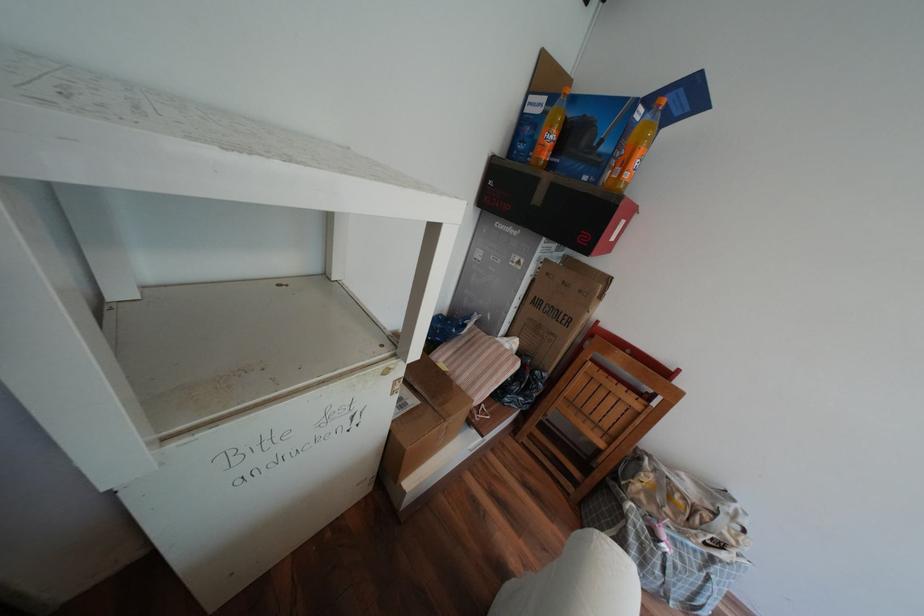
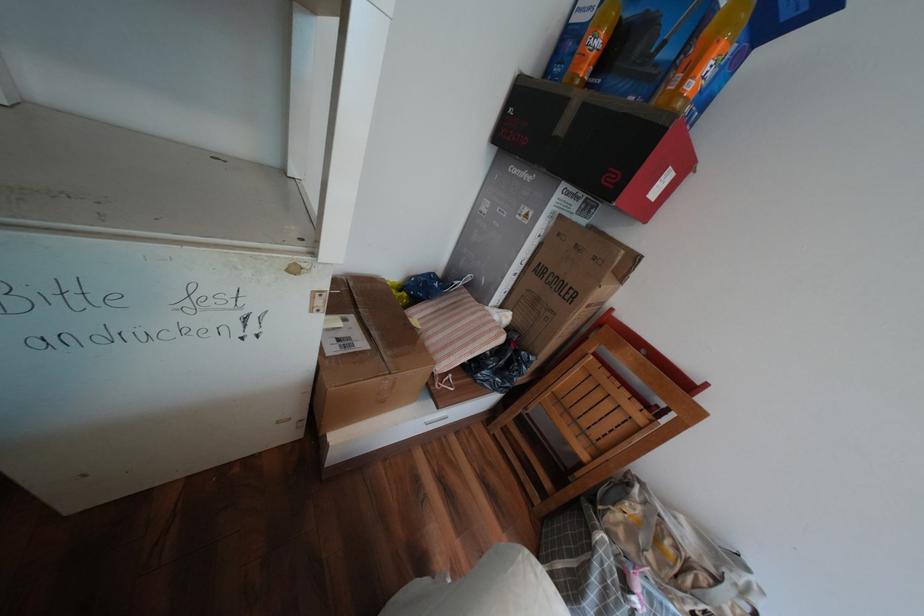
Question: How did the camera likely rotate?

Choices:
 (A) Left
 (B) Right
 (C) Up
 (D) Down

Answer: (A)